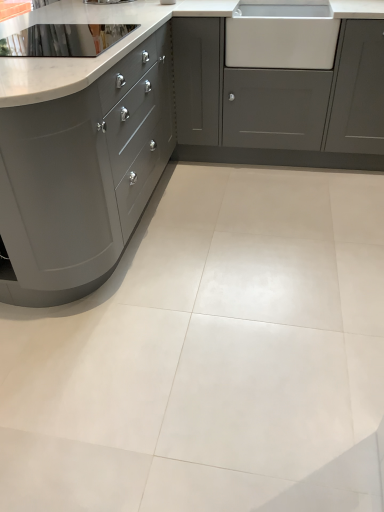
What are the coordinates of `blank space above white glossy tile at center (from a real-world perspective)` in the screenshot? It's located at (240, 284).